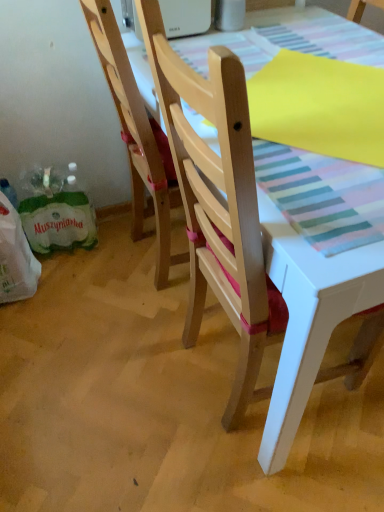
What are the coordinates of `vacant area to the right of green plastic grocery bag at lower left` in the screenshot? It's located at (63, 282).